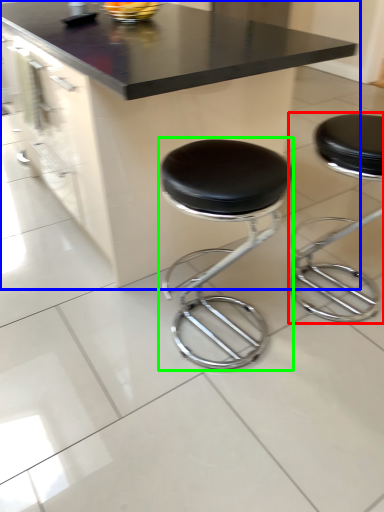
Question: Estimate the real-world distances between objects in this image. Which object is farther from stool (highlighted by a red box), table (highlighted by a blue box) or stool (highlighted by a green box)?

Choices:
 (A) table
 (B) stool

Answer: (A)